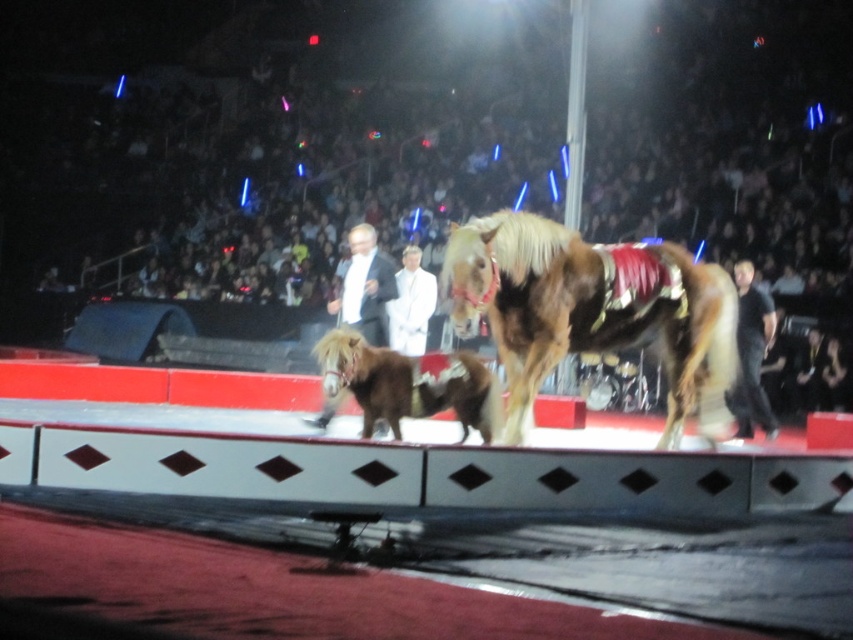
Question: Based on their relative distances, which object is farther from the brown fuzzy horse at center?

Choices:
 (A) white satin suit at center
 (B) black smooth shirt at right
 (C) brown glossy horse at center

Answer: (B)

Question: Which object appears closest to the camera in this image?

Choices:
 (A) black smooth shirt at right
 (B) brown fuzzy horse at center
 (C) brown glossy horse at center

Answer: (C)

Question: Is brown glossy horse at center further to the viewer compared to white satin suit at center?

Choices:
 (A) yes
 (B) no

Answer: (B)

Question: Estimate the real-world distances between objects in this image. Which object is farther from the brown fuzzy horse at center?

Choices:
 (A) white satin suit at center
 (B) black smooth shirt at right

Answer: (B)

Question: Is brown glossy horse at center thinner than brown fuzzy horse at center?

Choices:
 (A) no
 (B) yes

Answer: (A)

Question: Can you confirm if brown fuzzy horse at center is thinner than white satin suit at center?

Choices:
 (A) yes
 (B) no

Answer: (B)